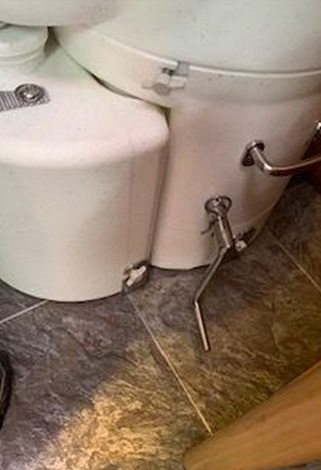
Identify the location of white grout. This screenshot has height=470, width=321. (156, 341).